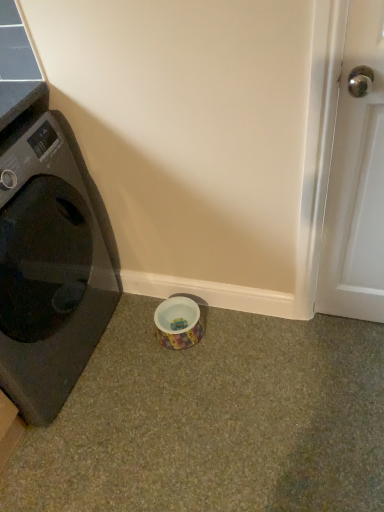
What are the coordinates of `free space above multicolored ceramic bowl at lower center (from a real-world perspective)` in the screenshot? It's located at (183, 311).